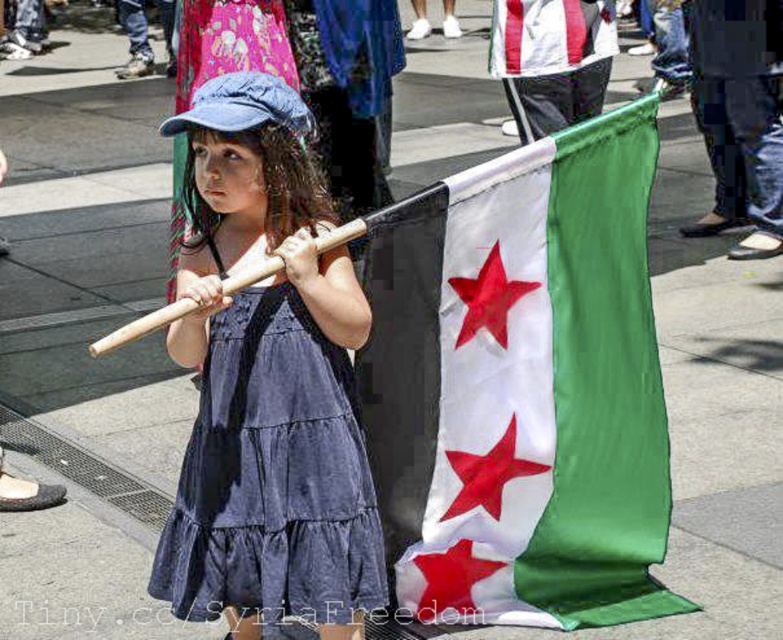
The girl is holding a silky fabric flag at center and wearing a denim dress at center. Which object is wider?

The silky fabric flag at center is wider than the denim dress at center.

You are a photographer trying to capture the girl in the denim dress at center. The silky fabric flag at center is blocking your view. Can you move the flag to get a clear shot of the dress?

The denim dress at center is behind the silky fabric flag at center, so you can move the flag to get a clear shot of the dress.

The girl is holding the silky fabric flag at center and wearing the denim dress at center. Which item takes up more space in the image?

The silky fabric flag at center is bigger than the denim dress at center, so it takes up more space in the image.